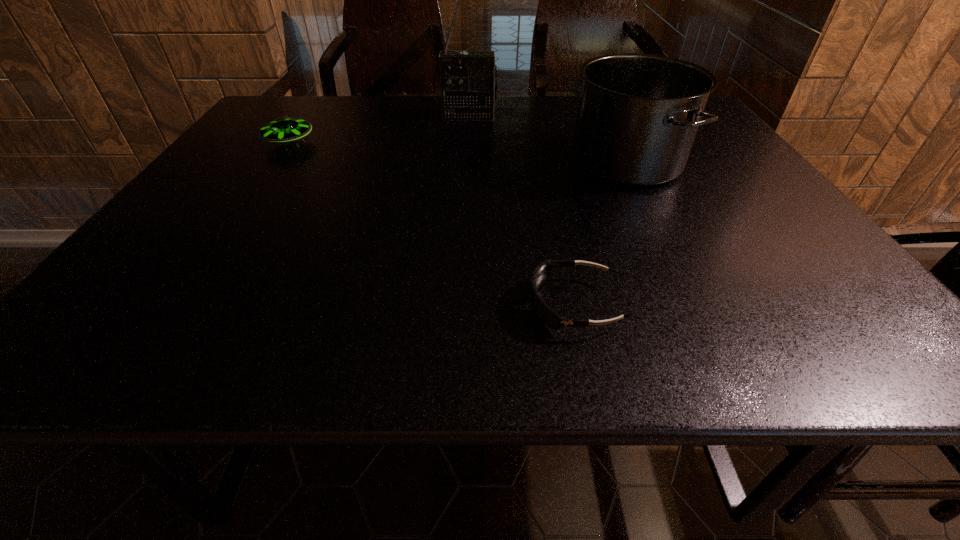
Locate an element on the screen. The height and width of the screenshot is (540, 960). unoccupied position between the third shortest object and the goggles is located at coordinates (600, 233).

This screenshot has height=540, width=960. I want to click on unoccupied position between the saucepan and the goggles, so click(600, 233).

This screenshot has height=540, width=960. What are the coordinates of `free space between the farthest object and the leftmost object` in the screenshot? It's located at (379, 130).

Select which object appears as the closest to the second tallest object. Please provide its 2D coordinates. Your answer should be formatted as a tuple, i.e. [(x, y)], where the tuple contains the x and y coordinates of a point satisfying the conditions above.

[(468, 79)]

Identify the location of the third closest object to the saucepan. The height and width of the screenshot is (540, 960). (283, 129).